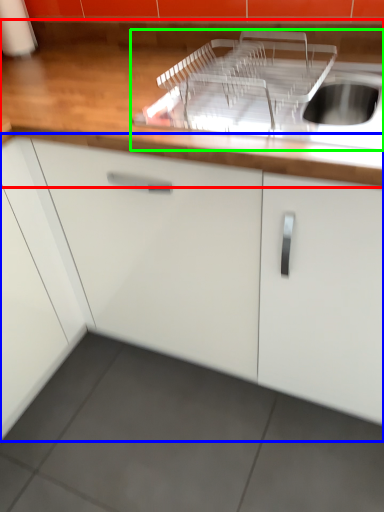
Question: Considering the real-world distances, which object is farthest from countertop (highlighted by a red box)? cabinetry (highlighted by a blue box) or sink (highlighted by a green box)?

Choices:
 (A) cabinetry
 (B) sink

Answer: (A)